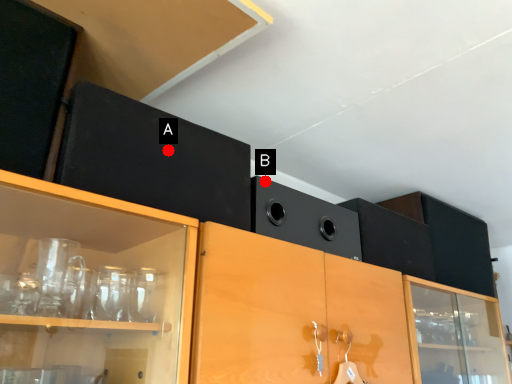
Question: Two points are circled on the image, labeled by A and B beside each circle. Among these points, which one is farthest from the camera?

Choices:
 (A) A is further
 (B) B is further

Answer: (B)